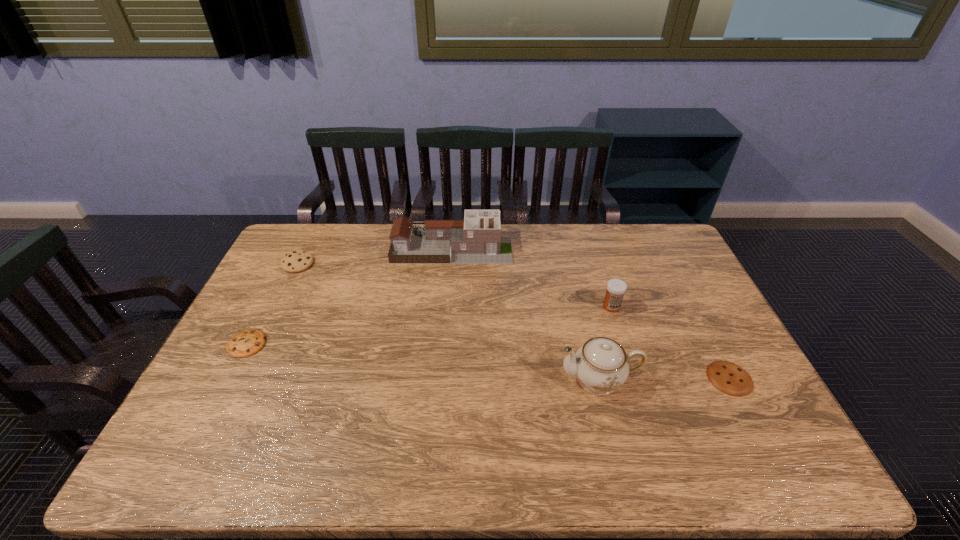
The height and width of the screenshot is (540, 960). I want to click on free space between the dollhouse and the second nearest cookie, so click(x=349, y=296).

You are a GUI agent. You are given a task and a screenshot of the screen. Output one action in this format:
    pyautogui.click(x=<x>, y=<y>)
    Task: Click on the free space that is in between the chinaware and the farthest cookie
    This screenshot has height=540, width=960.
    Given the screenshot: What is the action you would take?
    pyautogui.click(x=448, y=322)

Where is `vacant space in between the nearest cookie and the tallest cookie`? vacant space in between the nearest cookie and the tallest cookie is located at coordinates (514, 321).

The height and width of the screenshot is (540, 960). I want to click on empty space between the second farthest cookie and the chinaware, so click(x=423, y=362).

At what (x,y) coordinates should I click in order to perform the action: click on vacant point located between the medicine and the fourth farthest object. Please return your answer as a coordinate pair (x, y). This screenshot has height=540, width=960. Looking at the image, I should click on (429, 325).

Locate which object is the closest to the rightmost cookie. Please provide its 2D coordinates. Your answer should be formatted as a tuple, i.e. [(x, y)], where the tuple contains the x and y coordinates of a point satisfying the conditions above.

[(601, 365)]

The image size is (960, 540). I want to click on object that stands as the third closest to the tallest cookie, so click(601, 365).

At what (x,y) coordinates should I click in order to perform the action: click on the closest cookie relative to the second nearest cookie. Please return your answer as a coordinate pair (x, y). The width and height of the screenshot is (960, 540). Looking at the image, I should click on [297, 261].

Identify which cookie is the closest to the chinaware. Please provide its 2D coordinates. Your answer should be formatted as a tuple, i.e. [(x, y)], where the tuple contains the x and y coordinates of a point satisfying the conditions above.

[(731, 379)]

This screenshot has width=960, height=540. Identify the location of vacant region that satisfies the following two spatial constraints: 1. at the main entrance of the fourth object from right to left; 2. on the back side of the rightmost cookie. (442, 379).